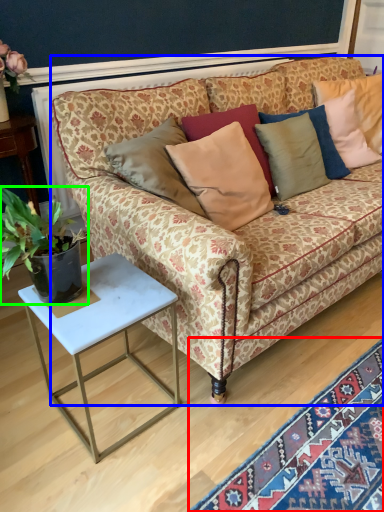
Question: Based on their relative distances, which object is nearer to mat (highlighted by a red box)? Choose from studio couch (highlighted by a blue box) and houseplant (highlighted by a green box).

Choices:
 (A) studio couch
 (B) houseplant

Answer: (A)